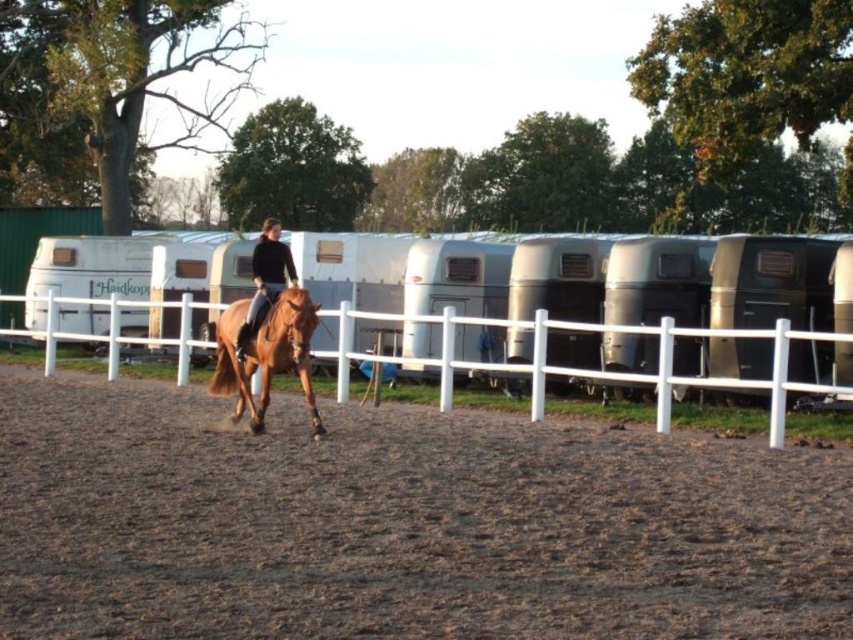
Question: Can you confirm if brown sandy dirt at center is positioned to the left of matte brown horse at center?

Choices:
 (A) no
 (B) yes

Answer: (A)

Question: Does white plastic fence at center have a larger size compared to matte brown horse at center?

Choices:
 (A) no
 (B) yes

Answer: (A)

Question: Among these points, which one is nearest to the camera?

Choices:
 (A) pos(780,337)
 (B) pos(250,467)
 (C) pos(262,230)

Answer: (B)

Question: Does shiny brown horse at center appear on the right side of matte brown horse at center?

Choices:
 (A) no
 (B) yes

Answer: (B)

Question: Which of the following is the farthest from the observer?

Choices:
 (A) (637, 445)
 (B) (537, 417)
 (C) (257, 276)

Answer: (B)

Question: Among these objects, which one is farthest from the camera?

Choices:
 (A) white plastic fence at center
 (B) matte brown horse at center

Answer: (B)